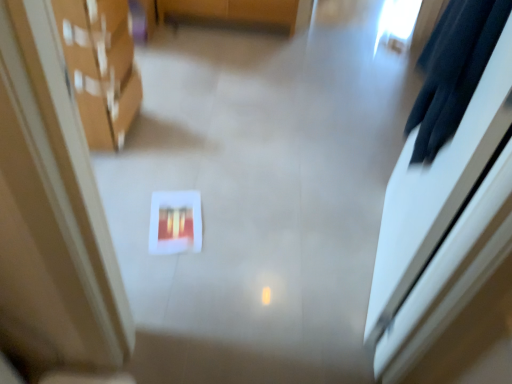
This screenshot has height=384, width=512. Identify the location of free spot above matte red book at center (from a real-world perspective). (178, 219).